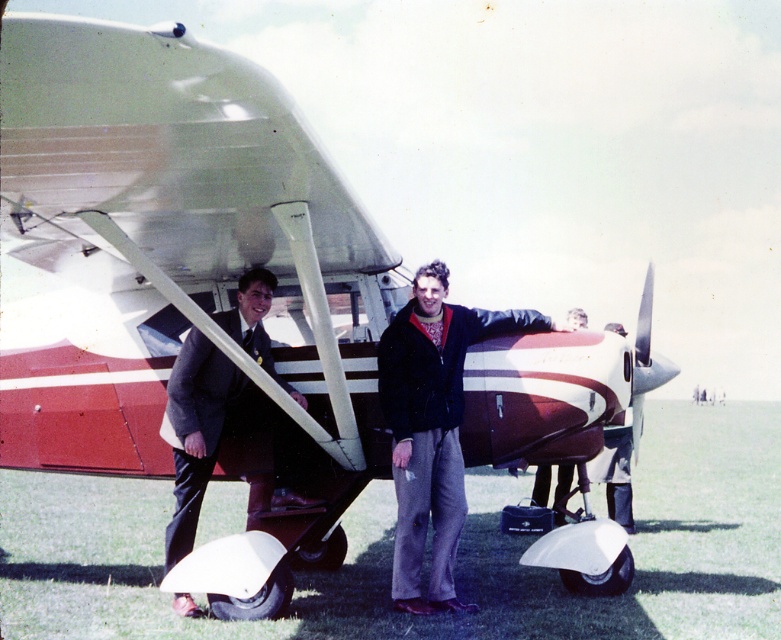
Question: Which of the following is the closest to the observer?

Choices:
 (A) (177, 547)
 (B) (547, 481)

Answer: (A)

Question: Which of the following is the farthest from the observer?

Choices:
 (A) matte black jacket at center
 (B) dark gray suit at lower left

Answer: (A)

Question: Is dark blue leather jacket at center behind dark gray suit at lower left?

Choices:
 (A) yes
 (B) no

Answer: (A)

Question: From the image, what is the correct spatial relationship of dark blue leather jacket at center in relation to matte black jacket at center?

Choices:
 (A) right
 (B) left

Answer: (B)

Question: Does dark blue leather jacket at center have a lesser width compared to dark gray suit at lower left?

Choices:
 (A) yes
 (B) no

Answer: (B)

Question: Which point is closer to the camera taking this photo?

Choices:
 (A) (201, 461)
 (B) (537, 476)

Answer: (A)